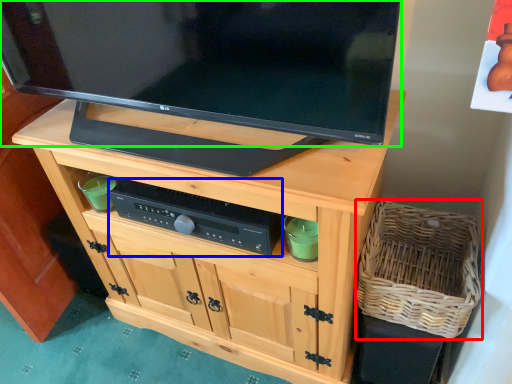
Question: Which object is positioned closest to basket (highlighted by a red box)? Select from control (highlighted by a blue box) and television (highlighted by a green box).

Choices:
 (A) control
 (B) television

Answer: (A)